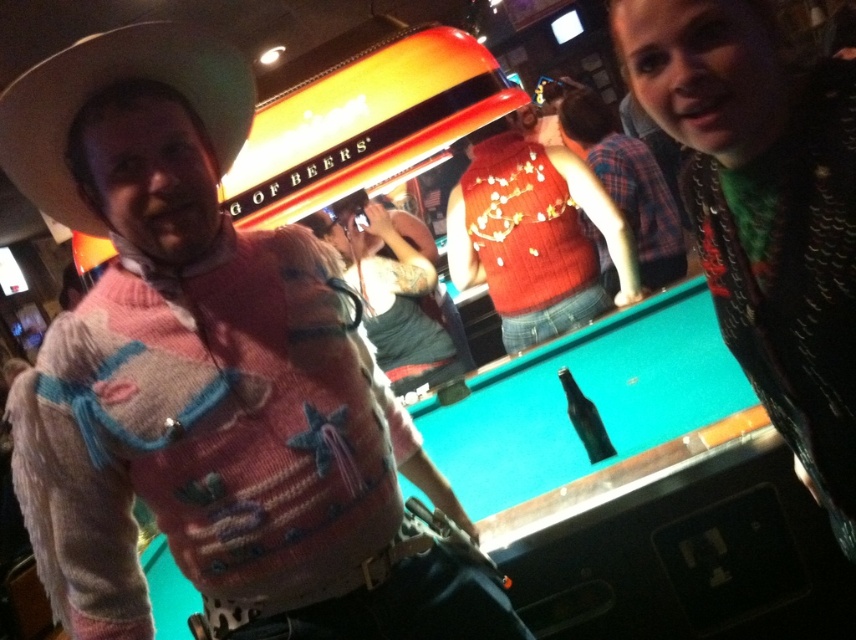
Can you confirm if teal felt pool table at center is wider than white felt cowboy hat at upper left?

Yes, teal felt pool table at center is wider than white felt cowboy hat at upper left.

Which is behind, point (682, 288) or point (217, 147)?

The point (682, 288) is behind.

Image resolution: width=856 pixels, height=640 pixels. I want to click on teal felt pool table at center, so click(x=587, y=396).

Who is higher up, knitted red sweater at center or knitted sweater at upper right?

knitted sweater at upper right

Who is lower down, knitted red sweater at center or knitted sweater at upper right?

Positioned lower is knitted red sweater at center.

Which is in front, point (490, 250) or point (657, 225)?

Point (490, 250) is in front.

Locate an element on the screen. Image resolution: width=856 pixels, height=640 pixels. knitted red sweater at center is located at coordinates (535, 236).

Is white felt cowboy hat at upper left positioned before knitted sweater at upper right?

That is True.

Who is lower down, white felt cowboy hat at upper left or knitted sweater at upper right?

white felt cowboy hat at upper left is below.

Which is behind, point (86, 227) or point (637, 248)?

Positioned behind is point (637, 248).

You are a GUI agent. You are given a task and a screenshot of the screen. Output one action in this format:
    pyautogui.click(x=<x>, y=<y>)
    Task: Click on the white felt cowboy hat at upper left
    
    Given the screenshot: What is the action you would take?
    pyautogui.click(x=111, y=83)